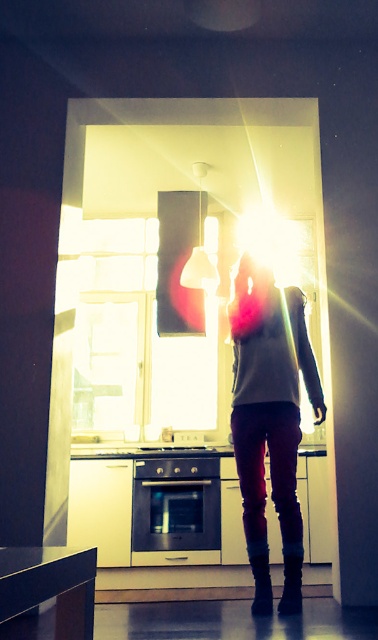
You are trying to fit a new microwave next to the metallic oven at center in your kitchen. The microwave is as wide as the leather boot at lower center. Based on the image, will the microwave fit next to the oven?

The metallic oven at center might be wider than leather boot at lower center, so the microwave, which is as wide as the leather boot at lower center, might not fit next to the oven since the oven is possibly wider.